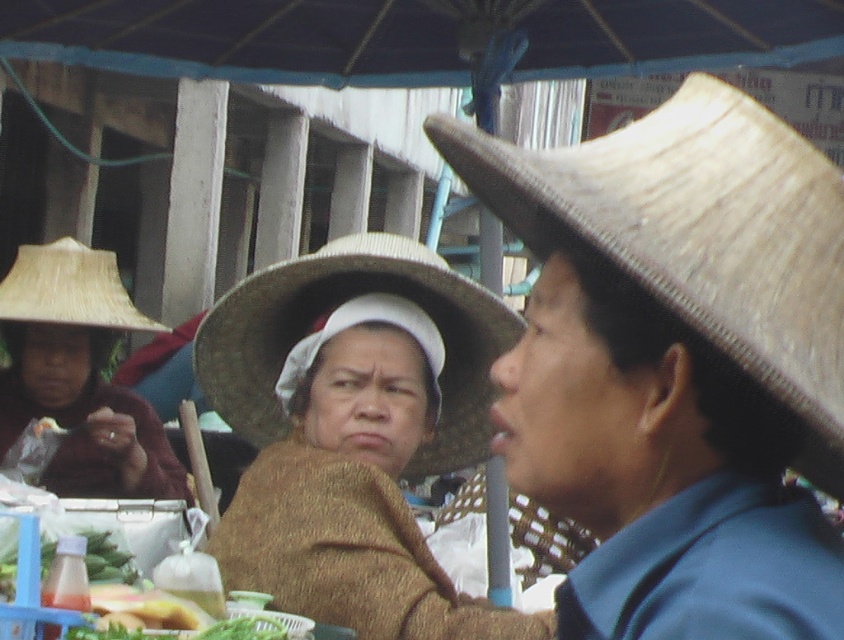
Question: Does brown straw hat at center appear on the right side of matte brown hat at left?

Choices:
 (A) no
 (B) yes

Answer: (B)

Question: Which object is farther from the camera taking this photo?

Choices:
 (A) brown woven hat at center
 (B) natural straw hat at left
 (C) bleached straw hat at center
 (D) brown straw hat at center

Answer: (B)

Question: Can you confirm if brown woven hat at center is wider than natural straw hat at left?

Choices:
 (A) yes
 (B) no

Answer: (A)

Question: Can you confirm if brown straw hat at center is positioned above natural straw hat at left?

Choices:
 (A) no
 (B) yes

Answer: (A)

Question: Which point is farther to the camera?

Choices:
 (A) (338, 269)
 (B) (491, 612)
 (C) (103, 467)

Answer: (C)

Question: Which point is closer to the camera?

Choices:
 (A) bleached straw hat at center
 (B) brown woven hat at center
 (C) matte brown hat at left
 (D) natural straw hat at left

Answer: (A)